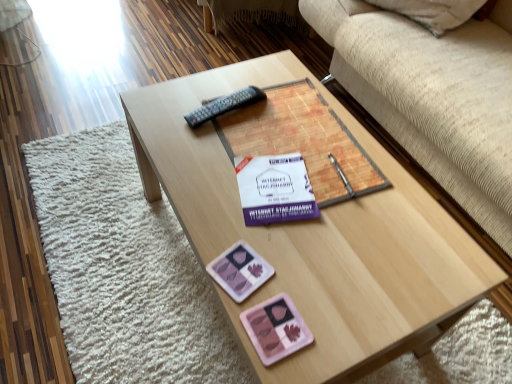
Find the location of `vacant area located to the right-hand side of white paper at center`. vacant area located to the right-hand side of white paper at center is located at coordinates (351, 200).